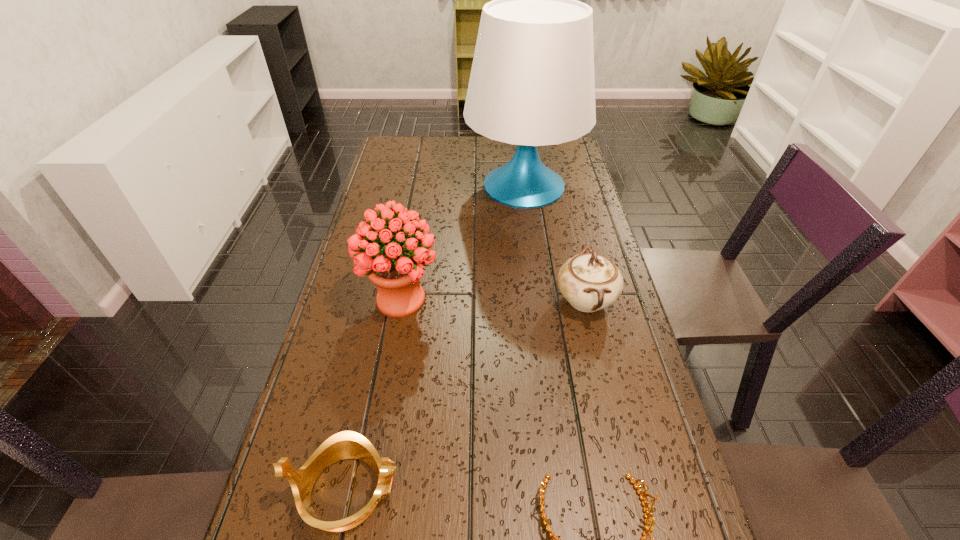
Locate an element on the screen. Image resolution: width=960 pixels, height=540 pixels. object that is the second closest to the table lamp is located at coordinates (396, 269).

This screenshot has height=540, width=960. Find the location of `the third closest object relative to the tallest object`. the third closest object relative to the tallest object is located at coordinates (347, 444).